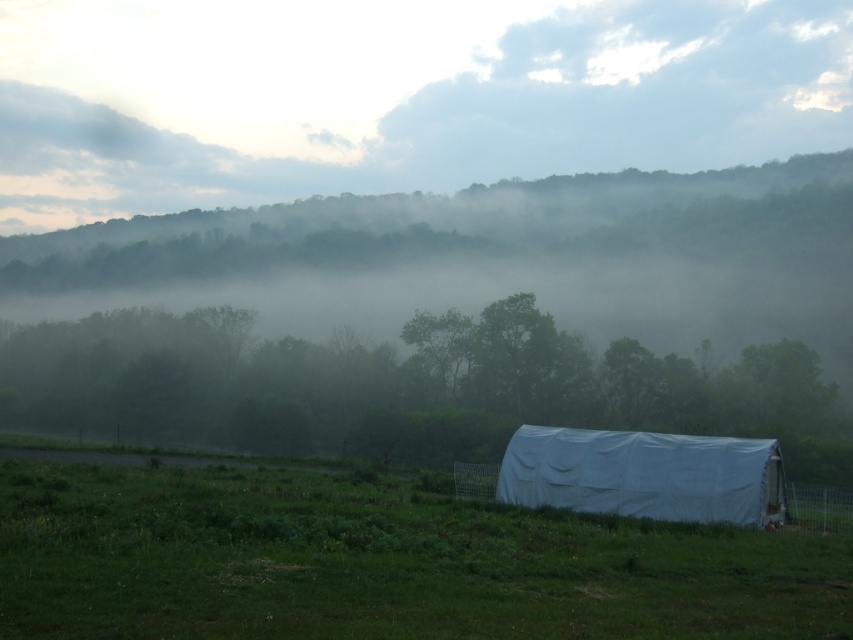
You are standing at the point labeled point (380, 563) in the image. What do you see around you?

You are standing in the green grassy field at lower center, which is part of the serene rural landscape depicted in the image.

You are standing at the edge of the green grassy field at lower center and want to walk towards the white fabric tent at lower center. Which direction should you head?

The white fabric tent at lower center is to the right of the green grassy field at lower center. So you should head to the right.